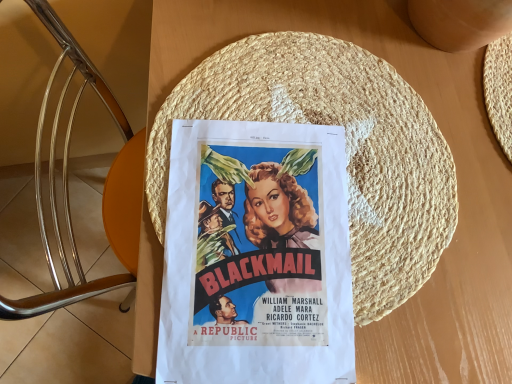
Question: Based on their sizes in the image, would you say matte paper poster at center is bigger or smaller than woven straw hat at center?

Choices:
 (A) big
 (B) small

Answer: (B)

Question: From their relative heights in the image, would you say matte paper poster at center is taller or shorter than woven straw hat at center?

Choices:
 (A) short
 (B) tall

Answer: (B)

Question: From a real-world perspective, is matte paper poster at center above or below woven straw hat at center?

Choices:
 (A) below
 (B) above

Answer: (A)

Question: Considering the positions of woven straw hat at center and matte paper poster at center in the image, is woven straw hat at center wider or thinner than matte paper poster at center?

Choices:
 (A) thin
 (B) wide

Answer: (B)

Question: Is point (410, 264) positioned closer to the camera than point (349, 253)?

Choices:
 (A) farther
 (B) closer

Answer: (A)

Question: Is woven straw hat at center taller or shorter than matte paper poster at center?

Choices:
 (A) short
 (B) tall

Answer: (A)

Question: Is woven straw hat at center in front of or behind matte paper poster at center in the image?

Choices:
 (A) behind
 (B) front

Answer: (A)